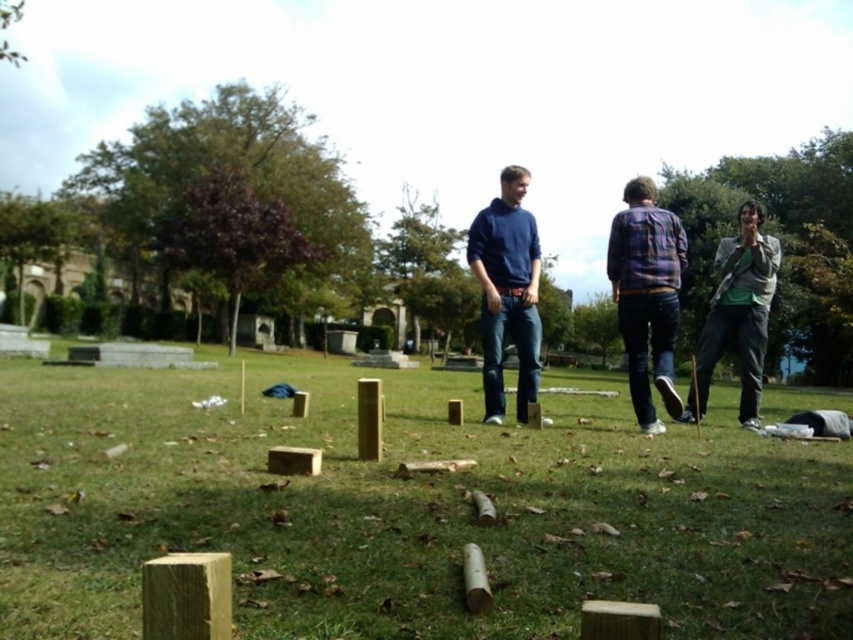
Does green grass at center come in front of green fabric jacket at right?

Yes, it is in front of green fabric jacket at right.

Between green grass at center and green fabric jacket at right, which one appears on the left side from the viewer's perspective?

green grass at center

Describe the element at coordinates (405, 509) in the screenshot. I see `green grass at center` at that location.

Where is `green grass at center`? The image size is (853, 640). green grass at center is located at coordinates (405, 509).

In the scene shown: Which of these two, plaid fabric shirt at center or green fabric jacket at right, stands taller?

With more height is green fabric jacket at right.

Does point (634, 212) come behind point (747, 253)?

No.

The image size is (853, 640). Describe the element at coordinates (647, 296) in the screenshot. I see `plaid fabric shirt at center` at that location.

This screenshot has width=853, height=640. I want to click on plaid fabric shirt at center, so click(647, 296).

Is green grass at center wider than plaid fabric shirt at center?

Indeed, green grass at center has a greater width compared to plaid fabric shirt at center.

Does point (283, 557) lie in front of point (676, 310)?

Yes, it is in front of point (676, 310).

Between point (375, 628) and point (660, 225), which one is positioned behind?

Point (660, 225)

Find the location of a particular element. green grass at center is located at coordinates (405, 509).